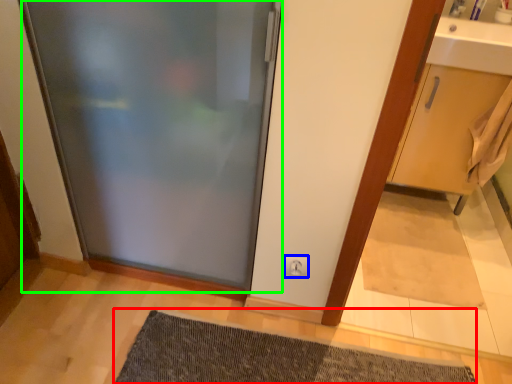
Question: Which object is positioned closest to bath mat (highlighted by a red box)? Select from electric outlet (highlighted by a blue box) and door (highlighted by a green box).

Choices:
 (A) electric outlet
 (B) door

Answer: (A)